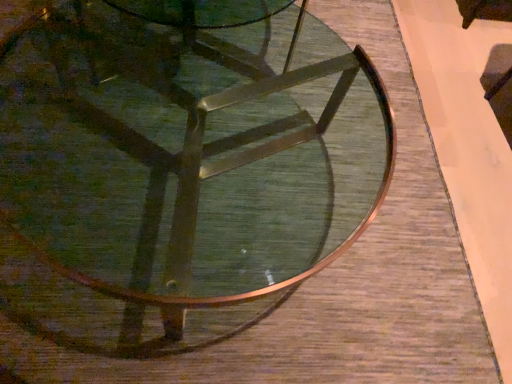
Describe the element at coordinates (177, 172) in the screenshot. This screenshot has height=384, width=512. I see `clear glass table at center` at that location.

Locate an element on the screen. The width and height of the screenshot is (512, 384). clear glass table at center is located at coordinates (177, 172).

Identify the location of clear glass table at center. (177, 172).